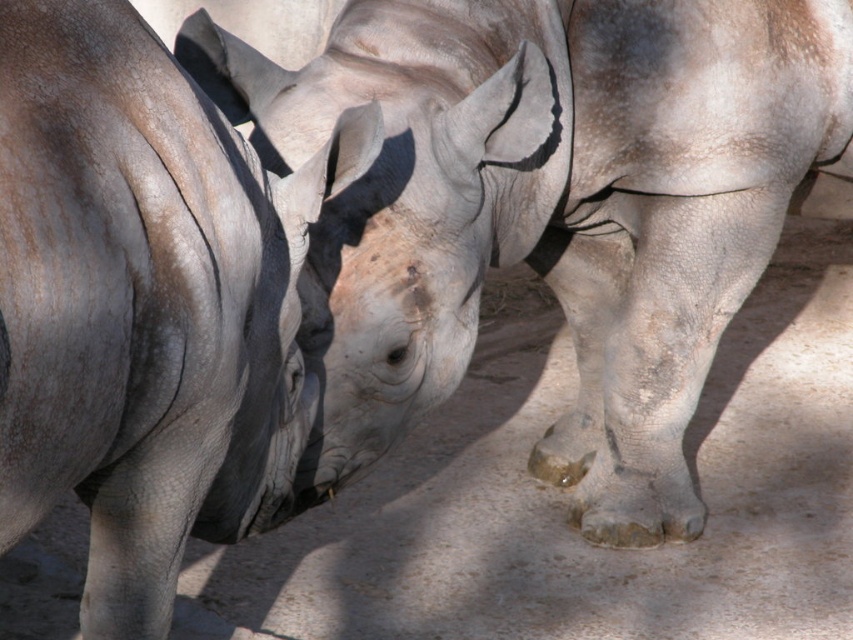
Question: Observing the image, what is the correct spatial positioning of gray textured rhino at center in reference to gray rough skin at center?

Choices:
 (A) above
 (B) below

Answer: (A)

Question: Which object appears closest to the camera in this image?

Choices:
 (A) gray textured rhino at center
 (B) gray rough skin at center

Answer: (B)

Question: Among these objects, which one is nearest to the camera?

Choices:
 (A) gray rough skin at center
 (B) gray textured rhino at center

Answer: (A)

Question: Is gray textured rhino at center positioned behind gray rough skin at center?

Choices:
 (A) no
 (B) yes

Answer: (B)

Question: Can you confirm if gray textured rhino at center is bigger than gray rough skin at center?

Choices:
 (A) no
 (B) yes

Answer: (B)